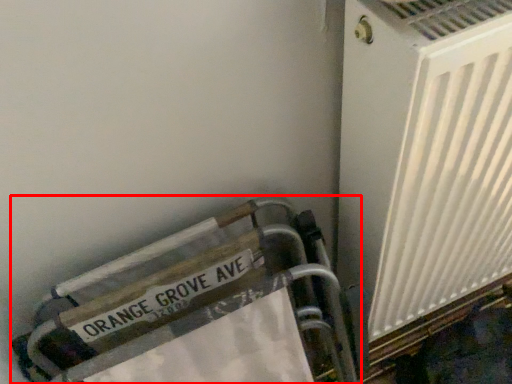
Question: From the image's perspective, considering the relative positions of furniture (annotated by the red box) and air conditioning in the image provided, where is furniture (annotated by the red box) located with respect to the staircase?

Choices:
 (A) below
 (B) above

Answer: (A)